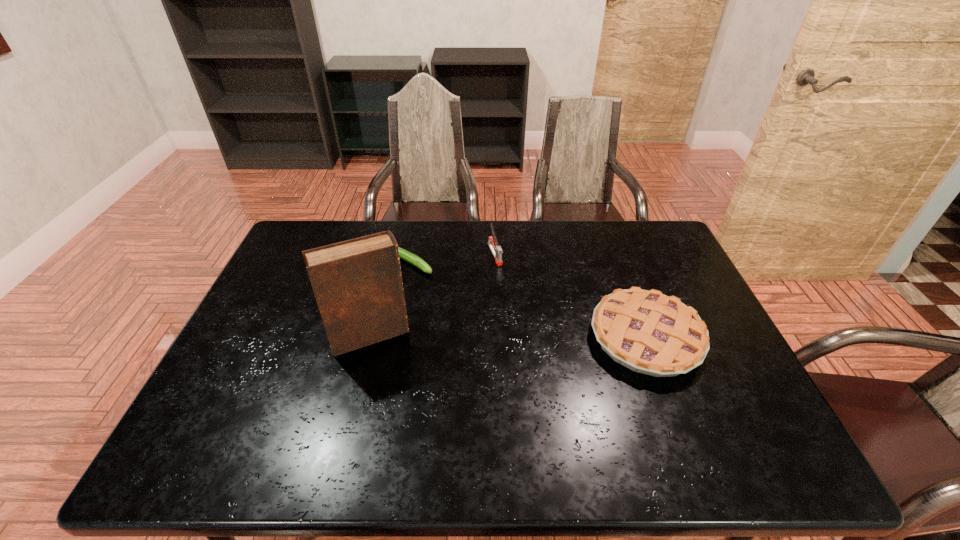
The image size is (960, 540). What are the coordinates of `vacant spot on the desktop that is between the Bible and the pie and is positioned on the front-facing side of the zucchini` in the screenshot? It's located at (545, 338).

Locate an element on the screen. vacant spot on the desktop that is between the tallest object and the second shortest object and is positioned on the handle side of the third shortest object is located at coordinates (537, 338).